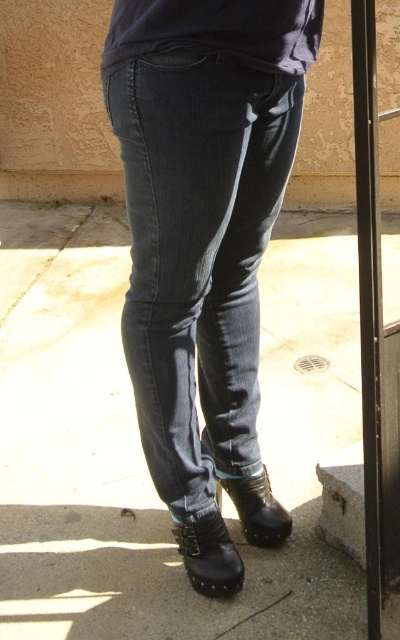
Between gray concrete pavement at lower center and dark blue denim jeans at center, which one has more height?

With more height is gray concrete pavement at lower center.

The height and width of the screenshot is (640, 400). I want to click on gray concrete pavement at lower center, so click(x=140, y=445).